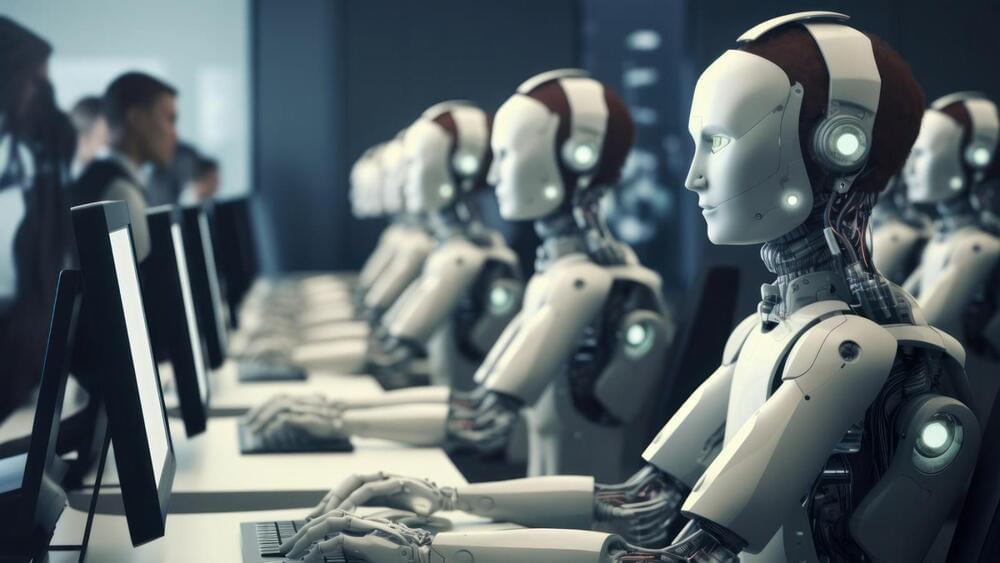
Image resolution: width=1000 pixels, height=563 pixels. I want to click on computer monitors, so (x=132, y=311), (x=186, y=301), (x=212, y=285), (x=232, y=270), (x=253, y=242).